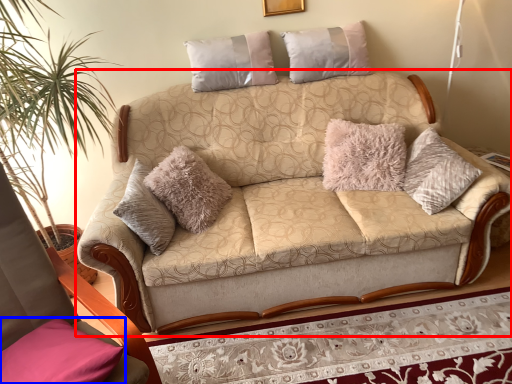
Question: Which object appears closest to the camera in this image, studio couch (highlighted by a red box) or pillow (highlighted by a blue box)?

Choices:
 (A) studio couch
 (B) pillow

Answer: (B)